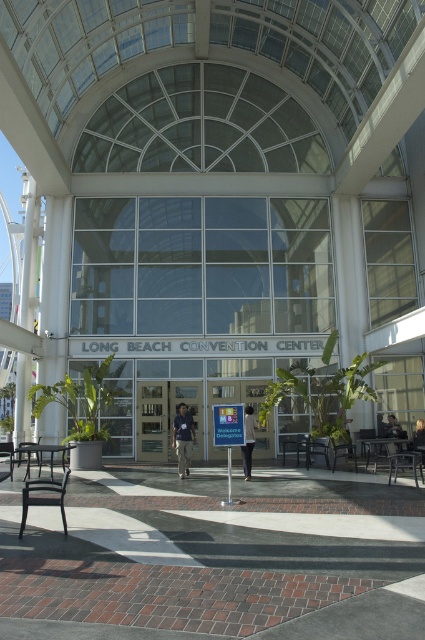
Is white glossy pillar at left taller than blue denim jeans at center?

Indeed, white glossy pillar at left has a greater height compared to blue denim jeans at center.

Measure the distance between white glossy pillar at left and blue denim jeans at center.

white glossy pillar at left is 6.85 meters from blue denim jeans at center.

Where is `white glossy pillar at left`? white glossy pillar at left is located at coordinates (30, 256).

Is wooden door at center positioned at the back of light brown leather jacket at lower right?

That is True.

Looking at this image, who is positioned more to the right, wooden door at center or light brown leather jacket at lower right?

light brown leather jacket at lower right is more to the right.

The width and height of the screenshot is (425, 640). In order to click on wooden door at center in this screenshot , I will do pyautogui.click(x=164, y=417).

I want to click on wooden door at center, so click(x=164, y=417).

Does blue denim jeans at center have a larger size compared to light brown leather jacket at lower right?

No, blue denim jeans at center is not bigger than light brown leather jacket at lower right.

Between blue denim jeans at center and light brown leather jacket at lower right, which one has more height?

blue denim jeans at center

Is point (184, 472) positioned behind point (416, 438)?

No, (184, 472) is closer to viewer.

Image resolution: width=425 pixels, height=640 pixels. Find the location of `blue denim jeans at center`. blue denim jeans at center is located at coordinates (183, 438).